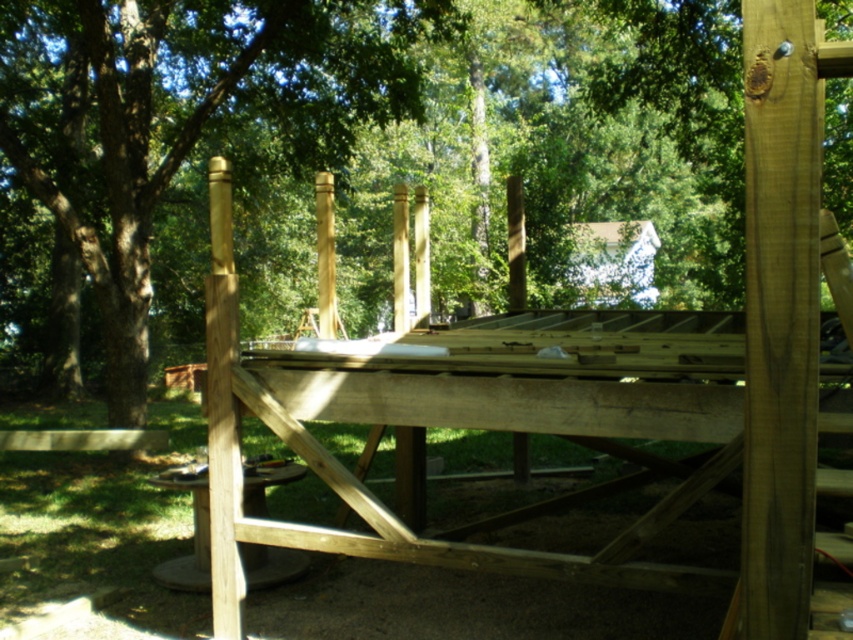
Question: Does brown wood tree at upper center have a smaller size compared to natural wood picnic table at center?

Choices:
 (A) yes
 (B) no

Answer: (B)

Question: Can you confirm if brown wood tree at upper center is positioned to the right of natural wood picnic table at center?

Choices:
 (A) yes
 (B) no

Answer: (B)

Question: Does brown wood tree at upper center appear on the left side of natural wood picnic table at center?

Choices:
 (A) yes
 (B) no

Answer: (A)

Question: Which point appears closest to the camera in this image?

Choices:
 (A) pos(1,288)
 (B) pos(759,502)

Answer: (B)

Question: Which object appears closest to the camera in this image?

Choices:
 (A) brown wood tree at upper center
 (B) natural wood picnic table at center

Answer: (B)